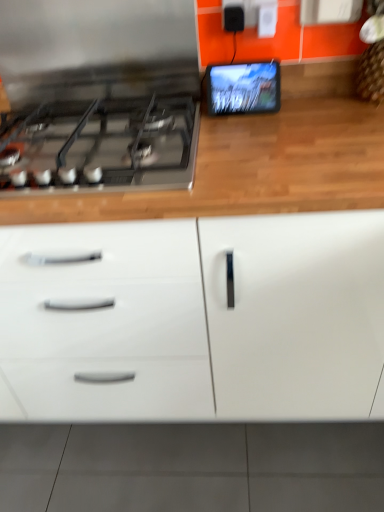
Image resolution: width=384 pixels, height=512 pixels. In order to click on vacant space situated above satin black gas stove at left (from a real-world perspective) in this screenshot , I will do `click(75, 117)`.